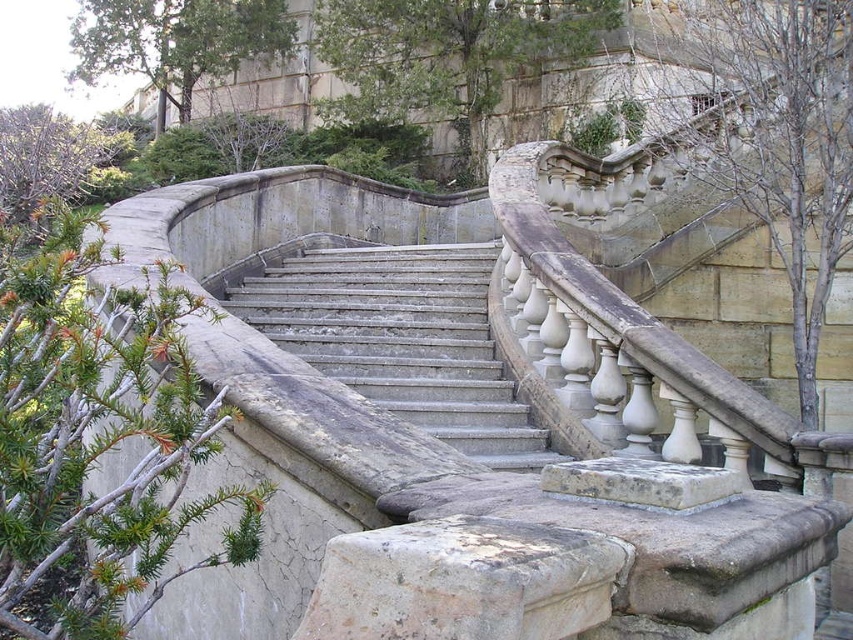
Can you confirm if gray stone stairs at center is wider than green leafy bush at upper left?

No.

Consider the image. Which of these two, gray stone stairs at center or green leafy bush at upper left, stands shorter?

With less height is gray stone stairs at center.

Is point (456, 285) positioned before point (51, 196)?

Yes, it is.

Find the location of a particular element. This screenshot has width=853, height=640. gray stone stairs at center is located at coordinates (402, 339).

Is point (86, 586) farther from camera compared to point (16, 170)?

No, (86, 586) is closer to viewer.

Does green leafy bush at left appear over green leafy bush at upper left?

Incorrect, green leafy bush at left is not positioned above green leafy bush at upper left.

Identify the location of green leafy bush at left. (96, 435).

Looking at this image, does gray stone stairs at center have a greater height compared to bare wood tree at upper right?

In fact, gray stone stairs at center may be shorter than bare wood tree at upper right.

Find the location of a particular element. gray stone stairs at center is located at coordinates point(402,339).